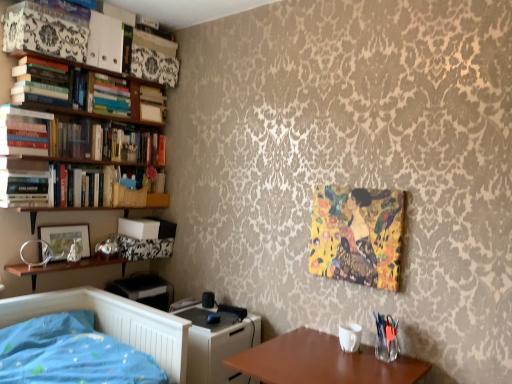
At what (x,y) coordinates should I click in order to perform the action: click on blank space situated above hardcover book at left, the sixth book positioned from the top (from a real-world perspective). Please return your answer as a coordinate pair (x, y). Looking at the image, I should click on (25, 158).